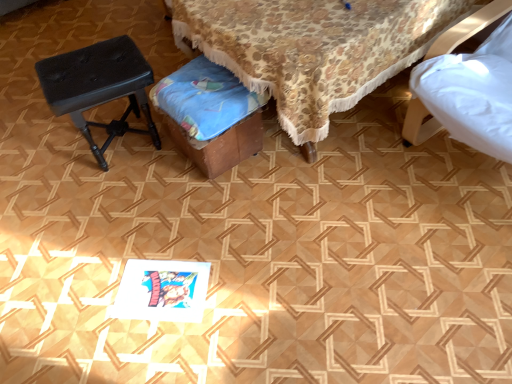
You are a GUI agent. You are given a task and a screenshot of the screen. Output one action in this format:
    pyautogui.click(x=<x>, y=<y>)
    Task: Click on the free space above black leather stool at left (from a real-world perspective)
    This screenshot has width=512, height=384.
    Given the screenshot: What is the action you would take?
    pyautogui.click(x=81, y=70)